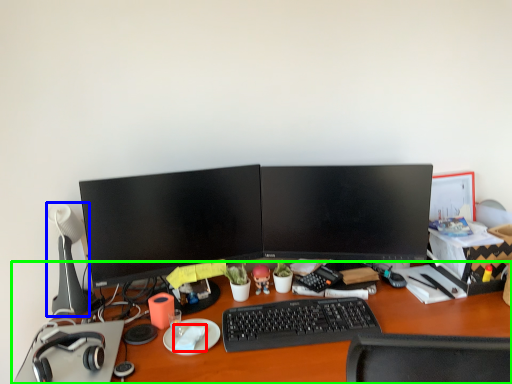
Question: Which is nearer to the notepad (highlighted by a red box)? table lamp (highlighted by a blue box) or desk (highlighted by a green box).

Choices:
 (A) table lamp
 (B) desk

Answer: (B)